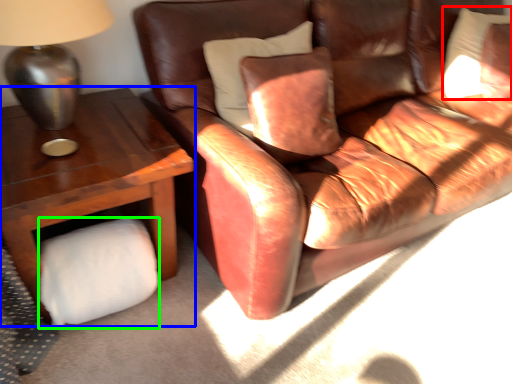
Question: Estimate the real-world distances between objects in this image. Which object is closer to pillow (highlighted by a red box), table (highlighted by a blue box) or toilet paper (highlighted by a green box)?

Choices:
 (A) table
 (B) toilet paper

Answer: (A)